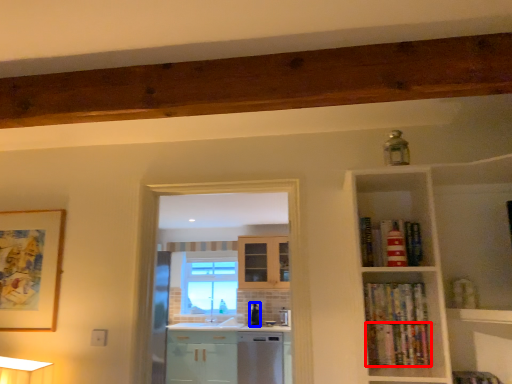
Question: Among these objects, which one is nearest to the camera, book (highlighted by a red box) or appliance (highlighted by a blue box)?

Choices:
 (A) book
 (B) appliance

Answer: (A)